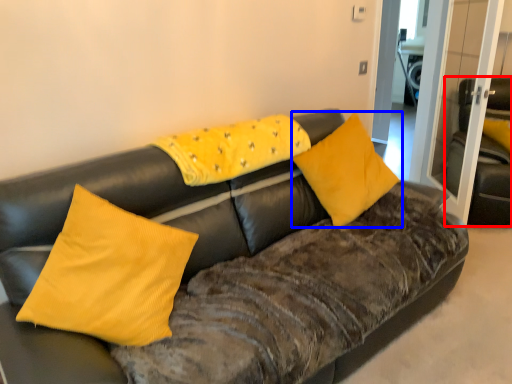
Question: Which object is closer to the camera taking this photo, armchair (highlighted by a red box) or pillow (highlighted by a blue box)?

Choices:
 (A) armchair
 (B) pillow

Answer: (B)